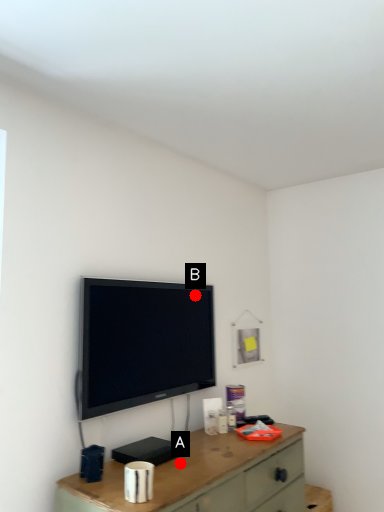
Question: Two points are circled on the image, labeled by A and B beside each circle. Which point appears closest to the camera in this image?

Choices:
 (A) A is closer
 (B) B is closer

Answer: (A)